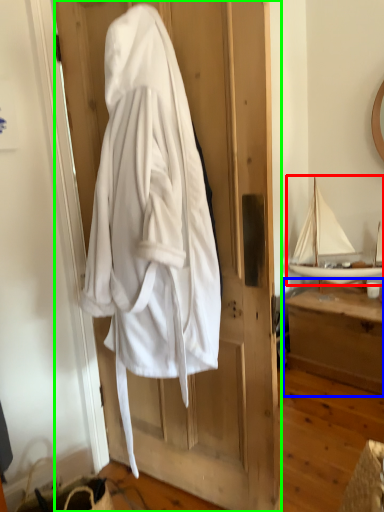
Question: Which object is the closest to the boat (highlighted by a red box)? Choose among these: furniture (highlighted by a blue box) or door (highlighted by a green box).

Choices:
 (A) furniture
 (B) door

Answer: (A)